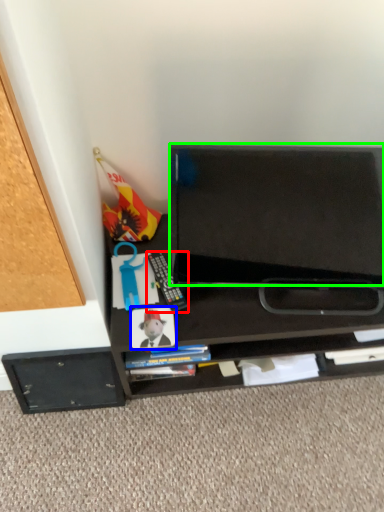
Question: Considering the real-world distances, which object is closest to equipment (highlighted by a red box)? paperback book (highlighted by a blue box) or back (highlighted by a green box).

Choices:
 (A) paperback book
 (B) back

Answer: (A)